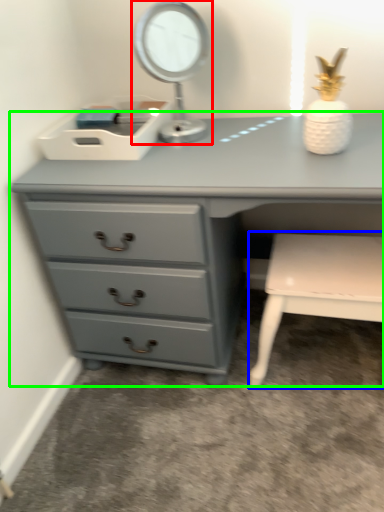
Question: Which object is the closest to the table lamp (highlighted by a red box)? Choose among these: chair (highlighted by a blue box) or chest of drawers (highlighted by a green box).

Choices:
 (A) chair
 (B) chest of drawers

Answer: (B)